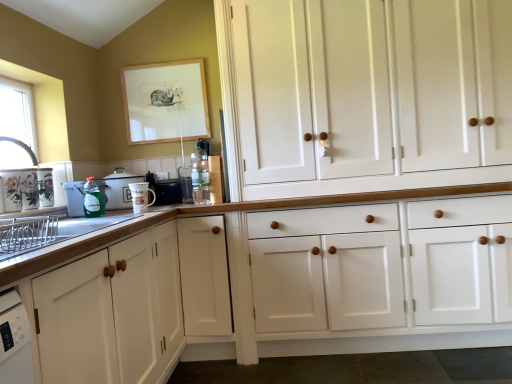
Question: In the image, is white wood cabinets at center, the 2th cabinetry from the left, positioned in front of or behind translucent glass bottle at center, the first bottle from the back?

Choices:
 (A) behind
 (B) front

Answer: (B)

Question: Is point (269, 187) closer or farther from the camera than point (206, 162)?

Choices:
 (A) closer
 (B) farther

Answer: (A)

Question: Which object is the farthest from the white wood cabinets at center, placed as the first cabinetry when sorted from right to left?

Choices:
 (A) green plastic bottle at left, which appears as the fourth appliance when viewed from the right
 (B) wooden picture frame at upper center
 (C) black plastic toaster at center, the fifth appliance viewed from the left
 (D) metallic silver toaster at upper center, arranged as the first appliance when viewed from the right
 (E) green plastic dish soap at left, which is the 2th appliance from left to right

Answer: (E)

Question: Which object is positioned closest to the white glossy cabinet at lower left, which ranks as the 1th cabinetry in left-to-right order?

Choices:
 (A) metallic silver toaster at upper center, arranged as the first appliance when viewed from the right
 (B) wooden picture frame at upper center
 (C) translucent glass bottle at center, positioned as the 1th bottle in right-to-left order
 (D) black plastic toaster at center, the fifth appliance viewed from the left
 (E) white wood cabinets at center, the 2th cabinetry from the left

Answer: (C)